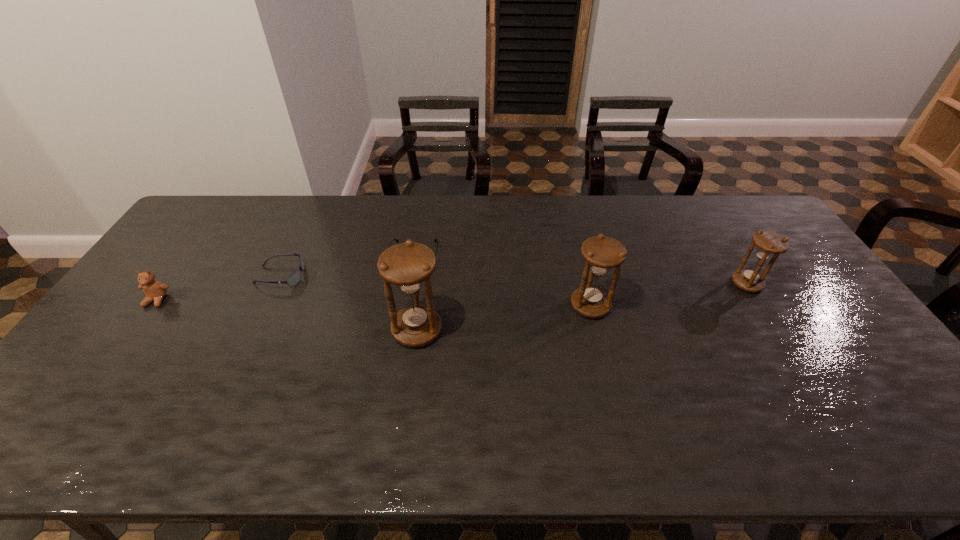
The image size is (960, 540). What are the coordinates of `the tallest hourglass` in the screenshot? It's located at (407, 265).

The height and width of the screenshot is (540, 960). Find the location of `the leftmost hourglass`. the leftmost hourglass is located at coordinates (407, 265).

Identify the location of the second hourglass from right to left. This screenshot has width=960, height=540. (602, 254).

The image size is (960, 540). Find the location of `the second shortest hourglass`. the second shortest hourglass is located at coordinates coord(602,254).

Find the location of a particular element. the rightmost object is located at coordinates (769, 244).

Where is `the third tallest object`? the third tallest object is located at coordinates (769, 244).

The width and height of the screenshot is (960, 540). What are the coordinates of `the shortest object` in the screenshot? It's located at (396, 240).

I want to click on the third shortest object, so click(x=154, y=290).

Image resolution: width=960 pixels, height=540 pixels. What are the coordinates of `the leftmost object` in the screenshot? It's located at (154, 290).

Locate an element on the screen. The image size is (960, 540). sunglasses is located at coordinates (295, 277).